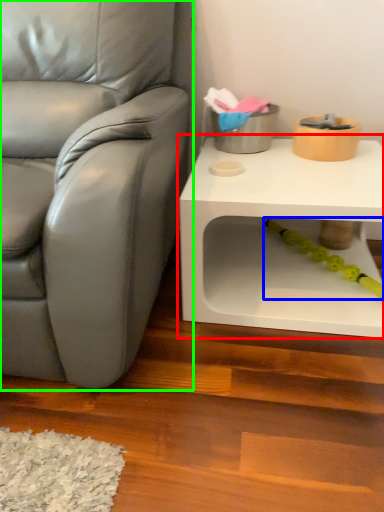
Question: Considering the real-world distances, which object is farthest from table (highlighted by a red box)? toy (highlighted by a blue box) or chair (highlighted by a green box)?

Choices:
 (A) toy
 (B) chair

Answer: (B)